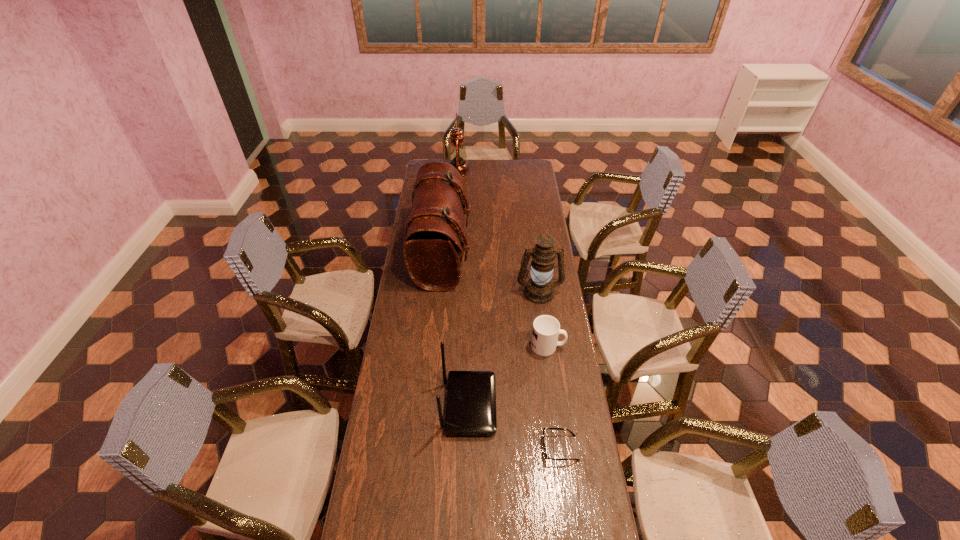
At what (x,y) coordinates should I click in order to perform the action: click on mug located in the right edge section of the desktop. Please return your answer as a coordinate pair (x, y). Looking at the image, I should click on (546, 329).

Locate an element on the screen. This screenshot has width=960, height=540. spectacles that is at the right edge is located at coordinates 547,458.

The height and width of the screenshot is (540, 960). Identify the location of object that is at the far left corner. (457, 155).

You are a GUI agent. You are given a task and a screenshot of the screen. Output one action in this format:
    pyautogui.click(x=<x>, y=<y>)
    Task: Click on the vacant area at the far edge of the desktop
    Image resolution: width=960 pixels, height=540 pixels.
    Given the screenshot: What is the action you would take?
    pyautogui.click(x=511, y=162)

Identify the location of vacant space at the left edge. This screenshot has width=960, height=540. (396, 332).

Identify the location of free space at the right edge. The image size is (960, 540). (571, 464).

The width and height of the screenshot is (960, 540). In the image, there is a desktop. In order to click on vacant space at the far right corner in this screenshot , I will do `click(536, 179)`.

Locate an element on the screen. The width and height of the screenshot is (960, 540). vacant area that lies between the satchel and the spectacles is located at coordinates (501, 351).

Find the location of a particular element. blank region between the shortest object and the farther oil lamp is located at coordinates (509, 310).

Find the location of a particular element. This screenshot has height=540, width=960. empty space between the shortest object and the taller oil lamp is located at coordinates (509, 310).